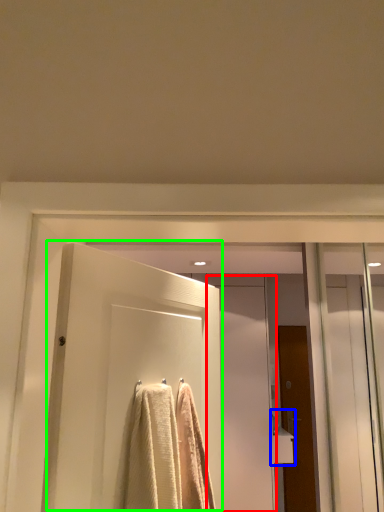
Question: Which object is the farthest from screen door (highlighted by a red box)? Choose among these: sink (highlighted by a blue box) or door (highlighted by a green box).

Choices:
 (A) sink
 (B) door

Answer: (B)